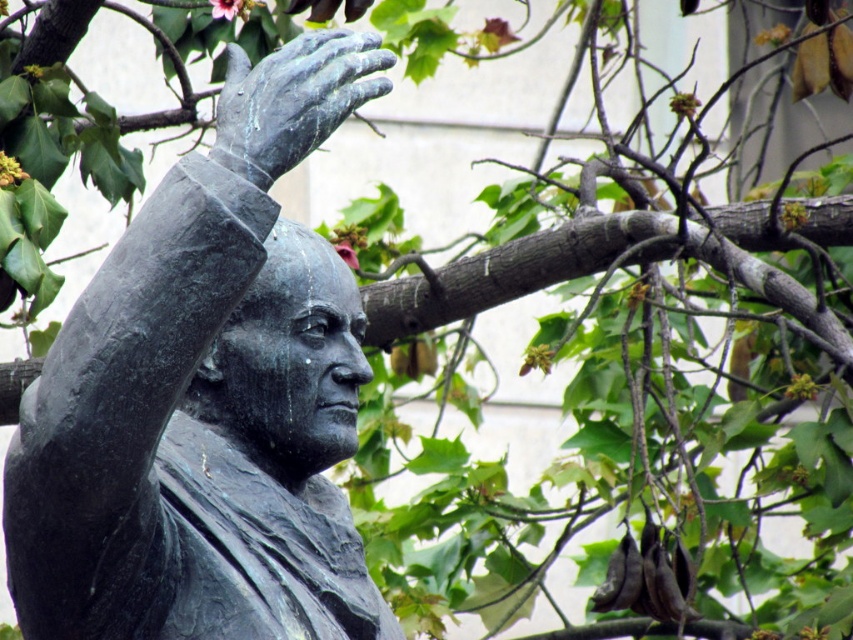
Question: Which point appears farthest from the camera in this image?

Choices:
 (A) (229, 44)
 (B) (13, 513)

Answer: (A)

Question: Is bronze statue at upper left smaller than bronze/grey metallic hand at upper center?

Choices:
 (A) no
 (B) yes

Answer: (A)

Question: Where is bronze statue at upper left located in relation to bronze/grey metallic hand at upper center in the image?

Choices:
 (A) left
 (B) right

Answer: (A)

Question: Is the position of bronze statue at upper left less distant than that of bronze/grey metallic hand at upper center?

Choices:
 (A) no
 (B) yes

Answer: (B)